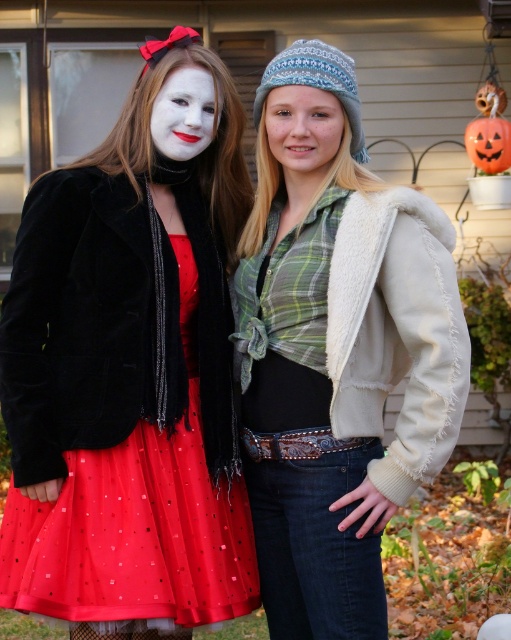
In the scene shown: You are a photographer trying to capture a closeup shot of both the smooth knit hat at center and the matte white face at center in the scene. Given that your camera can only focus on objects within a 12 inch range, will you be able to capture both subjects clearly in one shot?

The smooth knit hat at center and the matte white face at center are 15.04 inches apart, which exceeds the camera focus range of 12 inches. Therefore, you cannot capture both clearly in one shot.

You are taking a photo of two people standing in front of a house. You notice two points in the image at coordinates point (321, 561) and point (335, 118). Which point is closer to the camera?

Point (321, 561) is closer to the camera than point (335, 118).

You are a photographer setting up a shoot in front of a house with two subjects. You notice the velvet black jacket at left and the white knit hat at upper center. Which object is located to the left of the other?

The velvet black jacket at left is positioned on the left side of white knit hat at upper center.